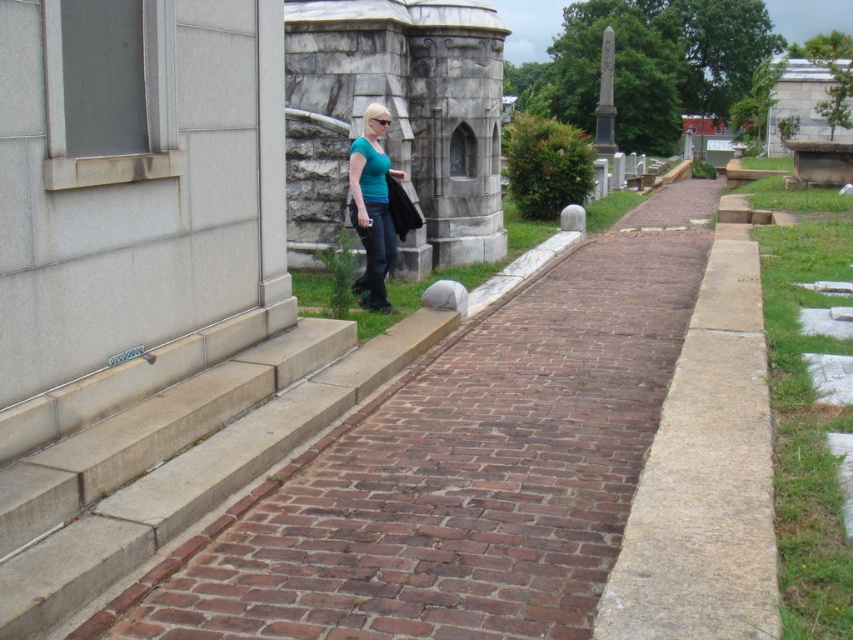
Question: Which object is positioned closest to the brick pavement at center?

Choices:
 (A) matte teal shirt at center
 (B) black marble obelisk at upper right

Answer: (A)

Question: Estimate the real-world distances between objects in this image. Which object is closer to the matte teal shirt at center?

Choices:
 (A) black marble obelisk at upper right
 (B) brick pavement at center

Answer: (B)

Question: Is brick pavement at center further to camera compared to black marble obelisk at upper right?

Choices:
 (A) no
 (B) yes

Answer: (A)

Question: Can you confirm if matte teal shirt at center is bigger than black marble obelisk at upper right?

Choices:
 (A) yes
 (B) no

Answer: (B)

Question: Estimate the real-world distances between objects in this image. Which object is closer to the matte teal shirt at center?

Choices:
 (A) brick pavement at center
 (B) black marble obelisk at upper right

Answer: (A)

Question: Does matte teal shirt at center appear under black marble obelisk at upper right?

Choices:
 (A) yes
 (B) no

Answer: (A)